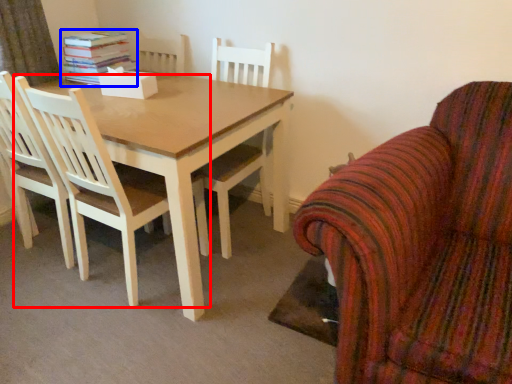
Question: Which object appears farthest to the camera in this image, chair (highlighted by a red box) or book (highlighted by a blue box)?

Choices:
 (A) chair
 (B) book

Answer: (B)